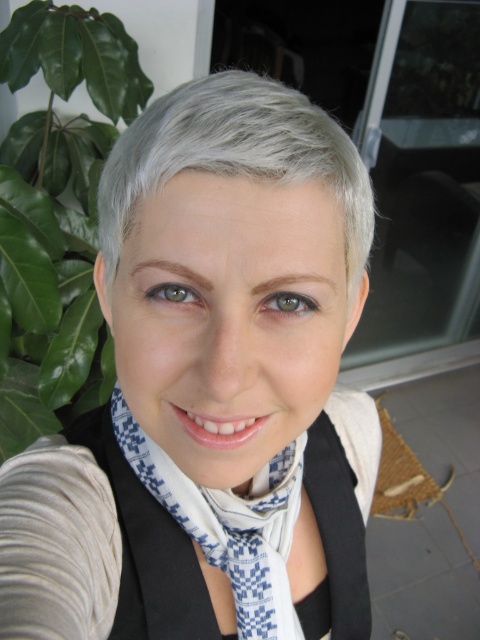
Does point (354, 292) come in front of point (263, 540)?

Yes, it is.

Is gray matte hair at upper center above white checkered scarf at center?

Yes, gray matte hair at upper center is above white checkered scarf at center.

This screenshot has width=480, height=640. Identify the location of gray matte hair at upper center. coord(235,154).

Which of these two, white matte scarf at center or white checkered scarf at center, stands taller?

Standing taller between the two is white matte scarf at center.

Can you confirm if white matte scarf at center is taller than white checkered scarf at center?

Yes, white matte scarf at center is taller than white checkered scarf at center.

Locate an element on the screen. white matte scarf at center is located at coordinates coord(211,388).

Which is more to the left, white matte scarf at center or gray matte hair at upper center?

From the viewer's perspective, white matte scarf at center appears more on the left side.

Measure the distance from white matte scarf at center to gray matte hair at upper center.

white matte scarf at center is 5.31 inches away from gray matte hair at upper center.

Does point (267, 598) lie behind point (127, 179)?

That is True.

Where is `white matte scarf at center`? This screenshot has width=480, height=640. white matte scarf at center is located at coordinates (211, 388).